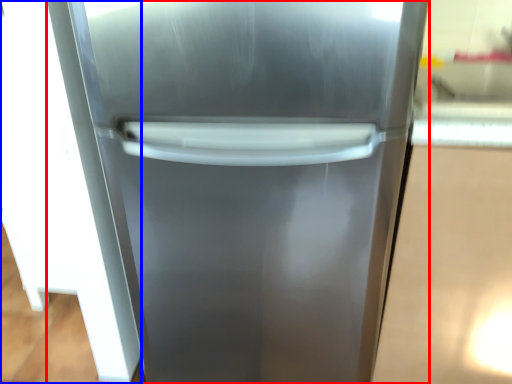
Question: Which object appears farthest to the camera in this image, refrigerator (highlighted by a red box) or glass door (highlighted by a blue box)?

Choices:
 (A) refrigerator
 (B) glass door

Answer: (B)